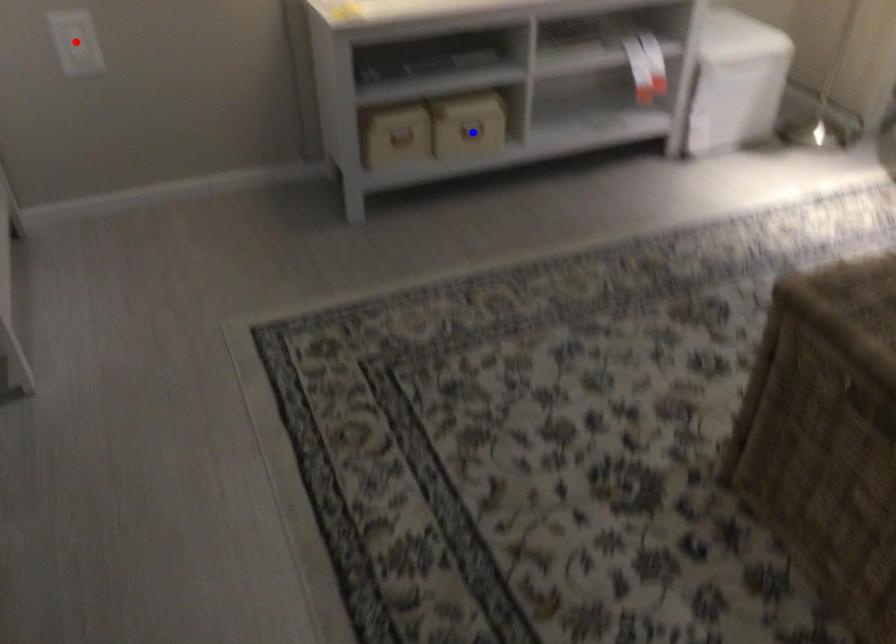
Question: In the image, two points are highlighted. Which point is nearer to the camera? Reply with the corresponding letter.

Choices:
 (A) blue point
 (B) red point

Answer: (B)